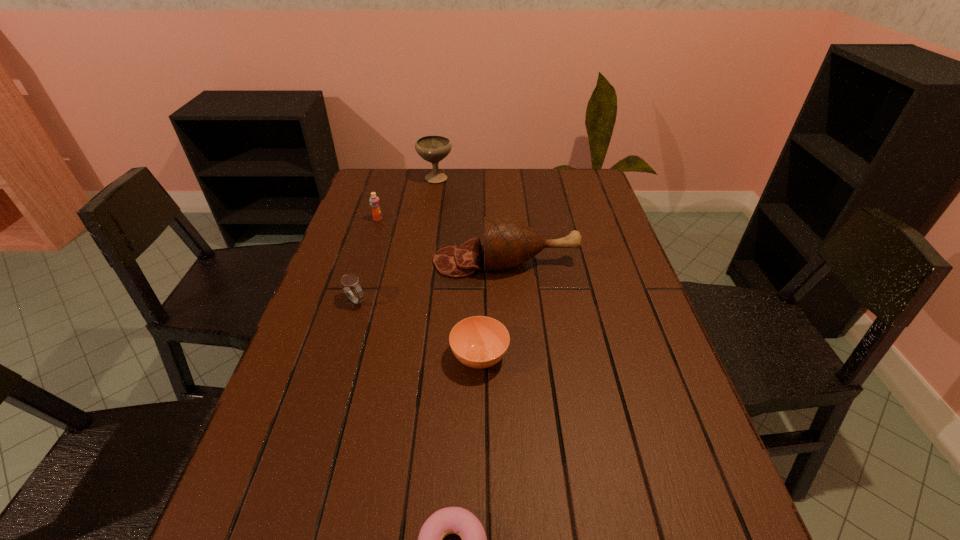
Find the location of a particular element. This screenshot has width=960, height=540. free location located on the right of the orange juice is located at coordinates (407, 219).

This screenshot has height=540, width=960. I want to click on vacant space located 0.240m on the right of the watch, so click(x=460, y=301).

Where is `free spot located on the left of the second nearest object`? free spot located on the left of the second nearest object is located at coordinates (355, 357).

Identify the location of object that is at the far edge. This screenshot has width=960, height=540. (433, 148).

You are a GUI agent. You are given a task and a screenshot of the screen. Output one action in this format:
    pyautogui.click(x=<x>, y=<y>)
    Task: Click on the orange juice that is at the left edge
    This screenshot has height=540, width=960.
    Given the screenshot: What is the action you would take?
    pyautogui.click(x=374, y=201)

You are a GUI agent. You are given a task and a screenshot of the screen. Output one action in this format:
    pyautogui.click(x=<x>, y=<y>)
    Task: Click on the watch that is positioned at the left edge
    The image size is (960, 540).
    Given the screenshot: What is the action you would take?
    pyautogui.click(x=347, y=280)

The width and height of the screenshot is (960, 540). What are the coordinates of `object situated at the right edge` in the screenshot? It's located at (508, 243).

What are the coordinates of `vacant space at the far edge` in the screenshot? It's located at (501, 185).

Locate an element on the screen. This screenshot has height=540, width=960. vacant space at the left edge of the desktop is located at coordinates (389, 209).

Locate an element on the screen. The image size is (960, 540). free space at the right edge is located at coordinates (615, 242).